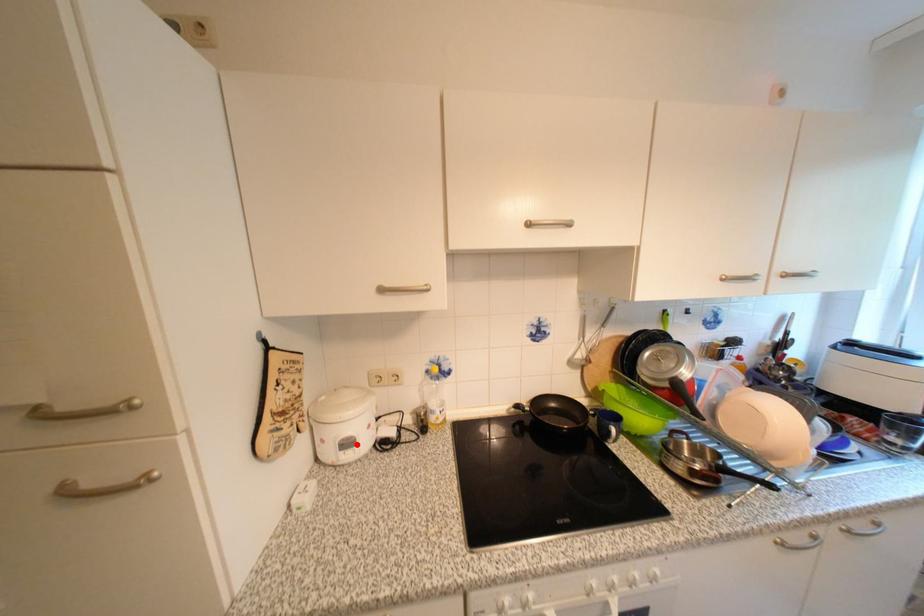
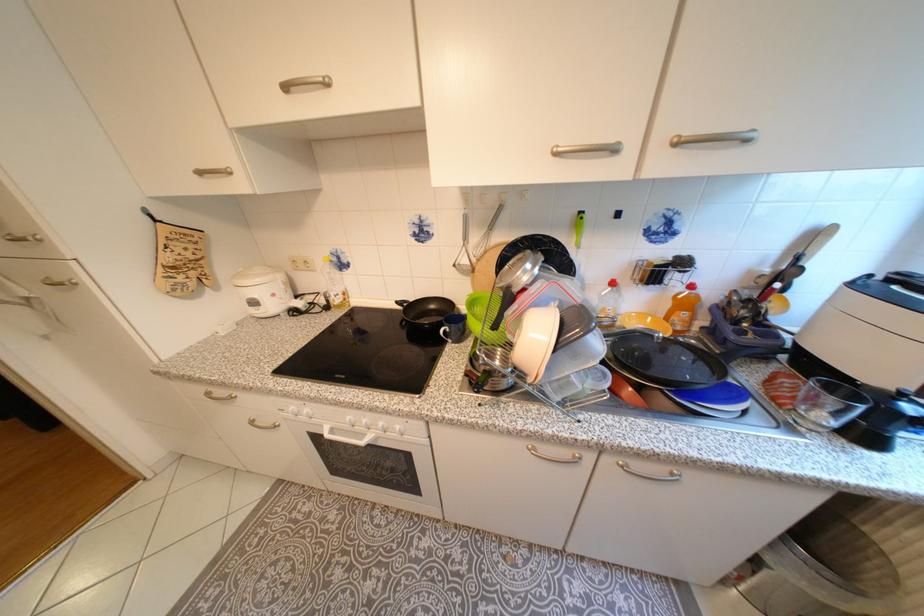
In the second image, find the point that corresponds to the highlighted location in the first image.

(263, 304)